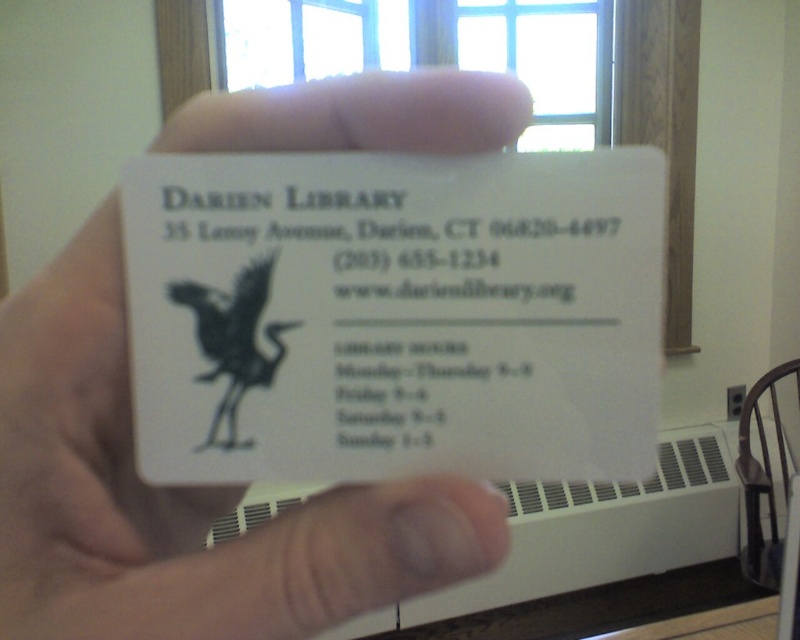
You are organizing a library event and need to place two business cards on a table. The cards are the white paper card at center and the white matte card at center. Which card will require more space on the table?

The white matte card at center will require more space on the table since it is larger than the white paper card at center according to the description.

What is the relationship in position between the white paper card at center and the white matte card at center in the image?

The white paper card at center is positioned to the right of the white matte card at center.